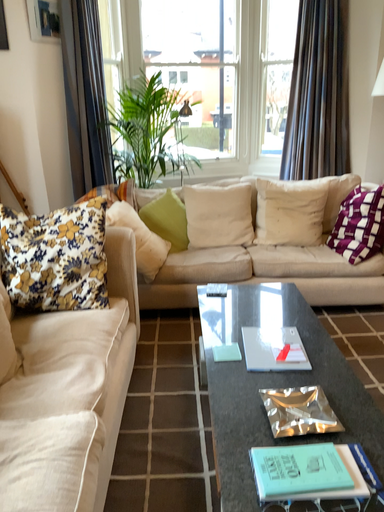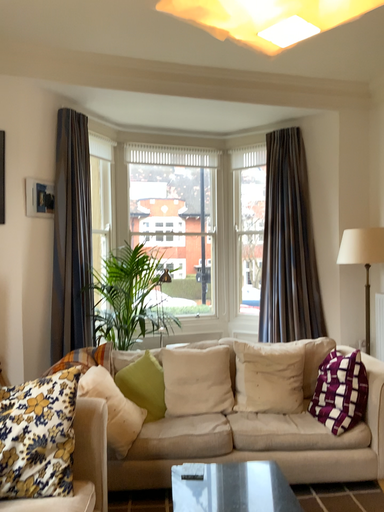
Question: Which way did the camera rotate in the video?

Choices:
 (A) rotated downward
 (B) rotated upward

Answer: (B)